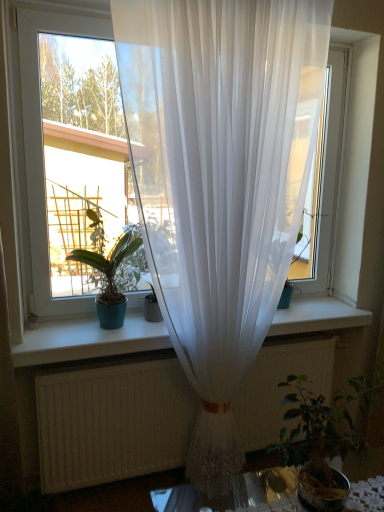
Find the location of a particular element. This screenshot has height=512, width=384. matte green pot at left, the second houseplant positioned from the right is located at coordinates (109, 278).

In order to face translucent white curtain at center, should I rotate leftwards or rightwards?

Turn right by 5.832 degrees to look at translucent white curtain at center.

The image size is (384, 512). What are the coordinates of `transparent white curtain at center` in the screenshot? It's located at (149, 151).

Identify the location of matte green pot at left, which is the 2th houseplant from bottom to top. The width and height of the screenshot is (384, 512). (109, 278).

Considering the relative sizes of translucent white curtain at center and transparent white curtain at center in the image provided, is translucent white curtain at center thinner than transparent white curtain at center?

Incorrect, the width of translucent white curtain at center is not less than that of transparent white curtain at center.

Which is correct: translucent white curtain at center is inside transparent white curtain at center, or outside of it?

translucent white curtain at center is not inside transparent white curtain at center, it's outside.

From the image's perspective, which one is positioned lower, translucent white curtain at center or transparent white curtain at center?

translucent white curtain at center is shown below in the image.

Which object is positioned more to the right, translucent white curtain at center or transparent white curtain at center?

translucent white curtain at center is more to the right.

Is green leafy plant at lower right, placed as the second houseplant when sorted from back to front, shorter than translucent white curtain at center?

Indeed, green leafy plant at lower right, placed as the second houseplant when sorted from back to front, has a lesser height compared to translucent white curtain at center.

In the scene shown: Considering the relative sizes of green leafy plant at lower right, the 1th houseplant in the front-to-back sequence, and translucent white curtain at center in the image provided, is green leafy plant at lower right, the 1th houseplant in the front-to-back sequence, bigger than translucent white curtain at center?

No, green leafy plant at lower right, the 1th houseplant in the front-to-back sequence, is not bigger than translucent white curtain at center.

From the image's perspective, which object appears higher, green leafy plant at lower right, the 1th houseplant in the front-to-back sequence, or translucent white curtain at center?

translucent white curtain at center, from the image's perspective.

Is green leafy plant at lower right, marked as the second houseplant in a top-to-bottom arrangement, oriented away from translucent white curtain at center?

Yes, green leafy plant at lower right, marked as the second houseplant in a top-to-bottom arrangement,'s orientation is away from translucent white curtain at center.

From the image's perspective, is green leafy plant at lower right, the 1th houseplant in the front-to-back sequence, beneath matte green pot at left, acting as the 1th houseplant starting from the left?

Correct, green leafy plant at lower right, the 1th houseplant in the front-to-back sequence, appears lower than matte green pot at left, acting as the 1th houseplant starting from the left, in the image.

Is matte green pot at left, the first houseplant positioned from the top, at the back of green leafy plant at lower right, the first houseplant from the right?

No, green leafy plant at lower right, the first houseplant from the right, is not facing the opposite direction of matte green pot at left, the first houseplant positioned from the top.

Which of these two, green leafy plant at lower right, marked as the second houseplant in a top-to-bottom arrangement, or matte green pot at left, the second houseplant in the front-to-back sequence, is smaller?

With smaller size is matte green pot at left, the second houseplant in the front-to-back sequence.

Visually, is green leafy plant at lower right, marked as the 2th houseplant in a left-to-right arrangement, positioned to the left or to the right of matte green pot at left, arranged as the first houseplant when viewed from the back?

In the image, green leafy plant at lower right, marked as the 2th houseplant in a left-to-right arrangement, appears on the right side of matte green pot at left, arranged as the first houseplant when viewed from the back.

Is matte green pot at left, which is the 2th houseplant from bottom to top, behind transparent white curtain at center?

That is True.

Image resolution: width=384 pixels, height=512 pixels. Identify the location of window above the matte green pot at left, the second houseplant positioned from the right (from the image's perspective). (149, 151).

Looking at this image, is matte green pot at left, the first houseplant positioned from the top, facing away from transparent white curtain at center?

That's right, matte green pot at left, the first houseplant positioned from the top, is facing away from transparent white curtain at center.

What's the angular difference between matte green pot at left, the second houseplant in the front-to-back sequence, and transparent white curtain at center's facing directions?

matte green pot at left, the second houseplant in the front-to-back sequence, and transparent white curtain at center are facing 0.000206 degrees away from each other.

Is matte green pot at left, the first houseplant positioned from the top, far from green leafy plant at lower right, the first houseplant from the right?

Absolutely, matte green pot at left, the first houseplant positioned from the top, is distant from green leafy plant at lower right, the first houseplant from the right.

Considering the relative positions of matte green pot at left, the second houseplant positioned from the right, and green leafy plant at lower right, marked as the 2th houseplant in a left-to-right arrangement, in the image provided, is matte green pot at left, the second houseplant positioned from the right, to the left or to the right of green leafy plant at lower right, marked as the 2th houseplant in a left-to-right arrangement,?

Clearly, matte green pot at left, the second houseplant positioned from the right, is on the left of green leafy plant at lower right, marked as the 2th houseplant in a left-to-right arrangement, in the image.

Is matte green pot at left, the second houseplant in the front-to-back sequence, bigger or smaller than green leafy plant at lower right, the first houseplant ordered from the bottom?

Considering their sizes, matte green pot at left, the second houseplant in the front-to-back sequence, takes up less space than green leafy plant at lower right, the first houseplant ordered from the bottom.

Would you say matte green pot at left, acting as the 1th houseplant starting from the left, contains green leafy plant at lower right, the first houseplant ordered from the bottom?

Actually, green leafy plant at lower right, the first houseplant ordered from the bottom, is outside matte green pot at left, acting as the 1th houseplant starting from the left.

In terms of size, does transparent white curtain at center appear bigger or smaller than matte green pot at left, the second houseplant in the front-to-back sequence?

Considering their sizes, transparent white curtain at center takes up more space than matte green pot at left, the second houseplant in the front-to-back sequence.

Is the position of transparent white curtain at center more distant than that of matte green pot at left, the second houseplant in the front-to-back sequence?

No, transparent white curtain at center is closer to the viewer.

Looking at this image, from a real-world perspective, is transparent white curtain at center under matte green pot at left, which is the 2th houseplant from bottom to top?

Incorrect, from a real-world perspective, transparent white curtain at center is higher than matte green pot at left, which is the 2th houseplant from bottom to top.

Which is more to the left, transparent white curtain at center or matte green pot at left, which is the 2th houseplant from bottom to top?

matte green pot at left, which is the 2th houseplant from bottom to top.

In the scene shown: Which of these two, translucent white curtain at center or green leafy plant at lower right, the first houseplant ordered from the bottom, is bigger?

translucent white curtain at center.

How many degrees apart are the facing directions of translucent white curtain at center and green leafy plant at lower right, the first houseplant ordered from the bottom?

There is a 2.37-degree angle between the facing directions of translucent white curtain at center and green leafy plant at lower right, the first houseplant ordered from the bottom.

Considering the relative sizes of translucent white curtain at center and green leafy plant at lower right, marked as the 2th houseplant in a left-to-right arrangement, in the image provided, is translucent white curtain at center shorter than green leafy plant at lower right, marked as the 2th houseplant in a left-to-right arrangement,?

In fact, translucent white curtain at center may be taller than green leafy plant at lower right, marked as the 2th houseplant in a left-to-right arrangement.

Where is `curtain on the left of the green leafy plant at lower right, the first houseplant from the right`? curtain on the left of the green leafy plant at lower right, the first houseplant from the right is located at coordinates (220, 178).

Identify the location of window that appears behind the translucent white curtain at center. (149, 151).

The width and height of the screenshot is (384, 512). I want to click on curtain above the green leafy plant at lower right, marked as the second houseplant in a top-to-bottom arrangement (from a real-world perspective), so click(x=220, y=178).

From the image, which object appears to be farther from translucent white curtain at center, matte green pot at left, the second houseplant positioned from the right, or transparent white curtain at center?

matte green pot at left, the second houseplant positioned from the right, is further to translucent white curtain at center.

From the picture: Looking at the image, which one is located closer to green leafy plant at lower right, marked as the 2th houseplant in a left-to-right arrangement, translucent white curtain at center or matte green pot at left, which is the 2th houseplant from bottom to top?

translucent white curtain at center.

From the image, which object appears to be nearer to transparent white curtain at center, matte green pot at left, acting as the 1th houseplant starting from the left, or translucent white curtain at center?

matte green pot at left, acting as the 1th houseplant starting from the left.

Which object lies nearer to the anchor point green leafy plant at lower right, marked as the 2th houseplant in a left-to-right arrangement, matte green pot at left, the first houseplant positioned from the top, or transparent white curtain at center?

matte green pot at left, the first houseplant positioned from the top, is positioned closer to the anchor green leafy plant at lower right, marked as the 2th houseplant in a left-to-right arrangement.

Based on their spatial positions, is green leafy plant at lower right, placed as the second houseplant when sorted from back to front, or transparent white curtain at center closer to matte green pot at left, the first houseplant positioned from the top?

Among the two, transparent white curtain at center is located nearer to matte green pot at left, the first houseplant positioned from the top.

Looking at the image, which one is located further to transparent white curtain at center, translucent white curtain at center or green leafy plant at lower right, placed as the second houseplant when sorted from back to front?

green leafy plant at lower right, placed as the second houseplant when sorted from back to front, lies further to transparent white curtain at center than the other object.

Which object lies nearer to the anchor point green leafy plant at lower right, marked as the second houseplant in a top-to-bottom arrangement, matte green pot at left, arranged as the first houseplant when viewed from the back, or translucent white curtain at center?

translucent white curtain at center is positioned closer to the anchor green leafy plant at lower right, marked as the second houseplant in a top-to-bottom arrangement.

Looking at the image, which one is located further to green leafy plant at lower right, marked as the 2th houseplant in a left-to-right arrangement, transparent white curtain at center or translucent white curtain at center?

Among the two, transparent white curtain at center is located further to green leafy plant at lower right, marked as the 2th houseplant in a left-to-right arrangement.

This screenshot has height=512, width=384. I want to click on curtain between matte green pot at left, which is the 2th houseplant from bottom to top, and green leafy plant at lower right, marked as the 2th houseplant in a left-to-right arrangement, so click(x=220, y=178).

You are a GUI agent. You are given a task and a screenshot of the screen. Output one action in this format:
    pyautogui.click(x=<x>, y=<y>)
    Task: Click on the houseplant between transparent white curtain at center and green leafy plant at lower right, the 1th houseplant in the front-to-back sequence, vertically
    
    Given the screenshot: What is the action you would take?
    pyautogui.click(x=109, y=278)

Locate an element on the screen. window located between matte green pot at left, the second houseplant in the front-to-back sequence, and translucent white curtain at center in the left-right direction is located at coordinates (149, 151).

Identify the location of curtain between transparent white curtain at center and green leafy plant at lower right, marked as the second houseplant in a top-to-bottom arrangement, in the vertical direction. Image resolution: width=384 pixels, height=512 pixels. (220, 178).